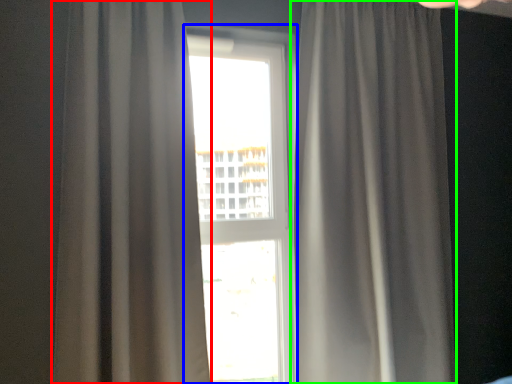
Question: Based on their relative distances, which object is nearer to curtain (highlighted by a red box)? Choose from window (highlighted by a blue box) and curtain (highlighted by a green box).

Choices:
 (A) window
 (B) curtain

Answer: (B)